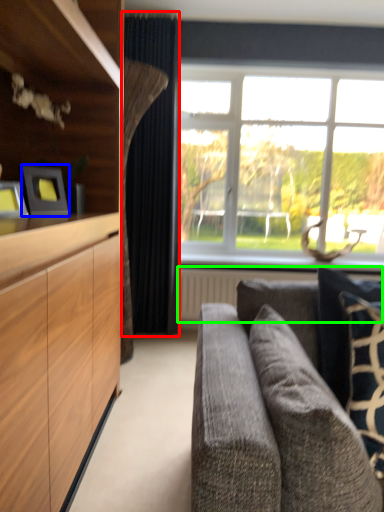
Question: Estimate the real-world distances between objects in this image. Which object is farther from curtain (highlighted by a red box), picture frame (highlighted by a blue box) or radiator (highlighted by a green box)?

Choices:
 (A) picture frame
 (B) radiator

Answer: (A)